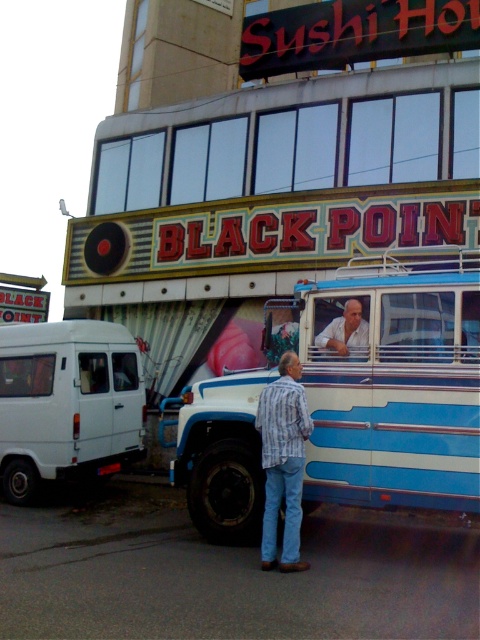
Is white matte van at left further to the viewer compared to white shirt at center?

That is True.

Measure the distance between point (x=101, y=376) and camera.

Point (x=101, y=376) is 9.47 meters from camera.

At what (x,y) coordinates should I click in order to perform the action: click on white matte van at left. Please return your answer as a coordinate pair (x, y). This screenshot has height=640, width=480. Looking at the image, I should click on (67, 403).

Which is in front, point (188, 403) or point (11, 460)?

Point (188, 403) is in front.

Can you confirm if blue striped bus at center is positioned to the right of white matte van at left?

Yes, blue striped bus at center is to the right of white matte van at left.

Which is behind, point (405, 502) or point (122, 372)?

Point (122, 372)

I want to click on blue striped bus at center, so click(349, 401).

Who is lower down, striped shirt at center or white shirt at center?

striped shirt at center is below.

Does striped shirt at center have a greater height compared to white shirt at center?

Yes.

Between point (264, 564) and point (321, 348), which one is positioned behind?

The point (321, 348) is behind.

You are a GUI agent. You are given a task and a screenshot of the screen. Output one action in this format:
    pyautogui.click(x=<x>, y=<y>)
    Task: Click on the striped shirt at center
    This screenshot has width=480, height=640.
    Given the screenshot: What is the action you would take?
    pyautogui.click(x=283, y=461)